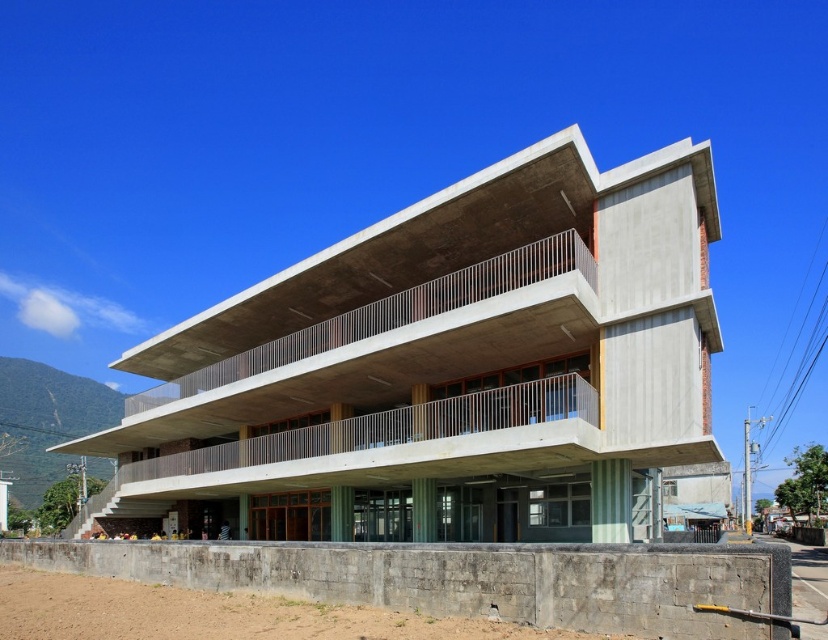
You are standing at the entrance of the modern building and want to reach the point marked as point (253, 317). If your walking speed is 1.5 meters per second, how many seconds will it take you to reach that point?

The distance between you and point (253, 317) is 42.33 meters. At a speed of 1.5 meters per second, it will take approximately 28.22 seconds to reach the point.

You are standing at the entrance of the concrete building at center. If you walk straight ahead, will you eventually reach the building?

The concrete building at center is located at point (445, 369) in 2D space, so if you walk straight ahead from the entrance, you will not reach the building as it is already at the center.

You are standing in front of the building and want to enter through the entrance located at the gray concrete wall at lower center. To reach the entrance, do you need to go up or down from your current position in front of the concrete building at center?

The concrete building at center is above the gray concrete wall at lower center, so you need to go down to reach the entrance located at the gray concrete wall at lower center from your current position in front of the concrete building at center.